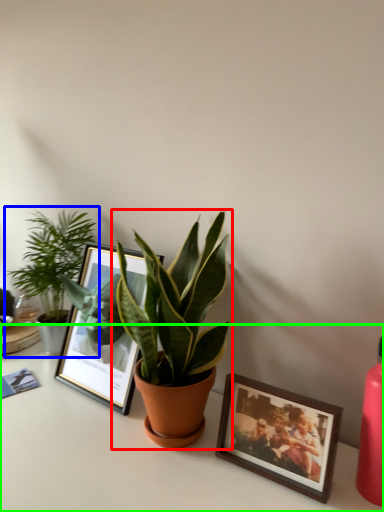
Question: Considering the real-world distances, which object is farthest from houseplant (highlighted by a red box)? houseplant (highlighted by a blue box) or table (highlighted by a green box)?

Choices:
 (A) houseplant
 (B) table

Answer: (A)